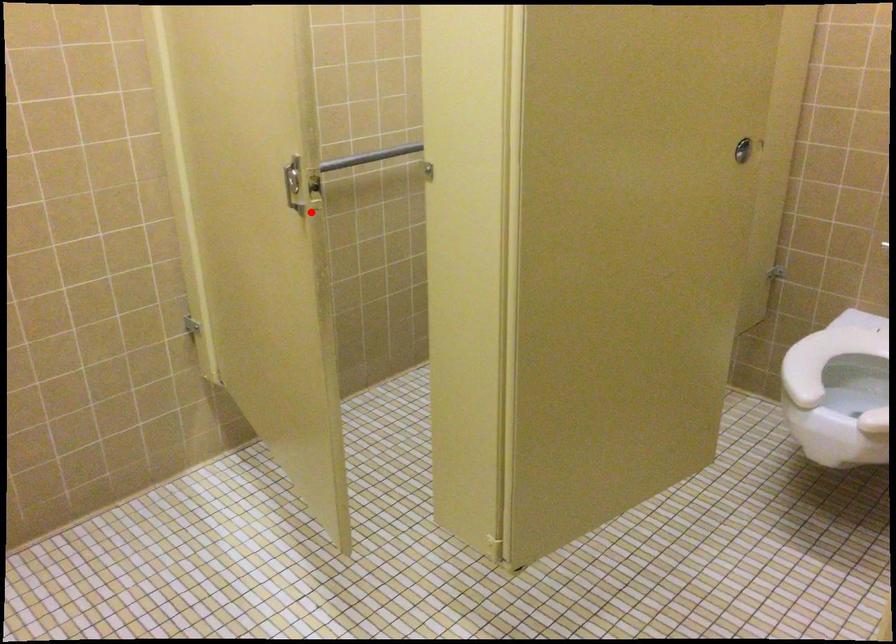
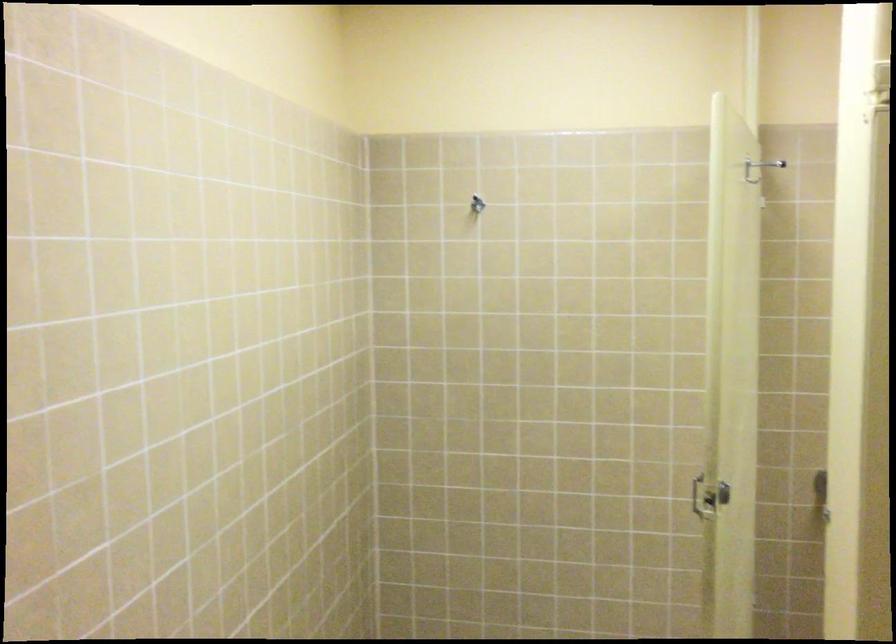
Question: I am providing you with two images of the same scene from different viewpoints. In image1, a red point is highlighted. Considering the same 3D point in image2, which of the following is correct?

Choices:
 (A) It is closer
 (B) It is farther

Answer: (B)